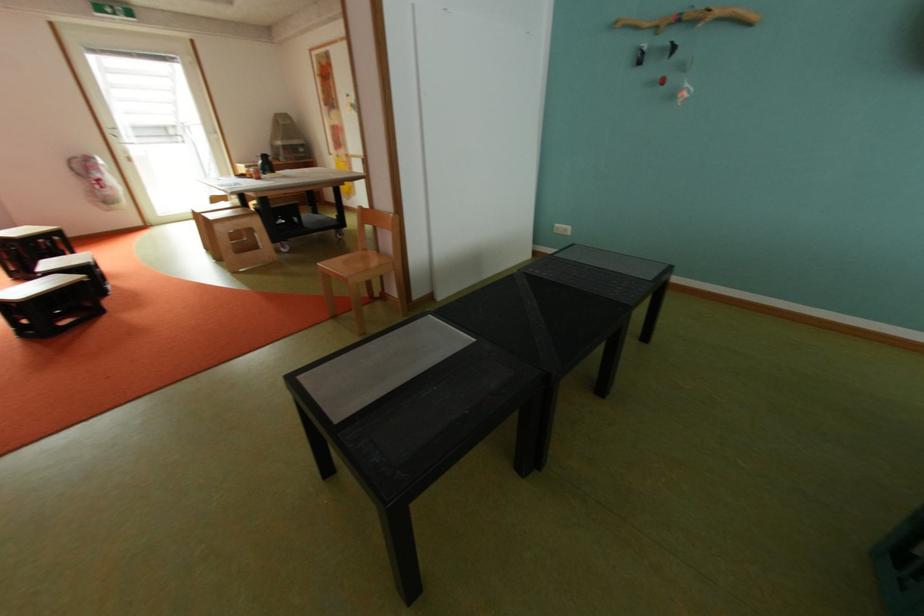
This screenshot has width=924, height=616. What do you see at coordinates (118, 143) in the screenshot?
I see `the vertical door handle` at bounding box center [118, 143].